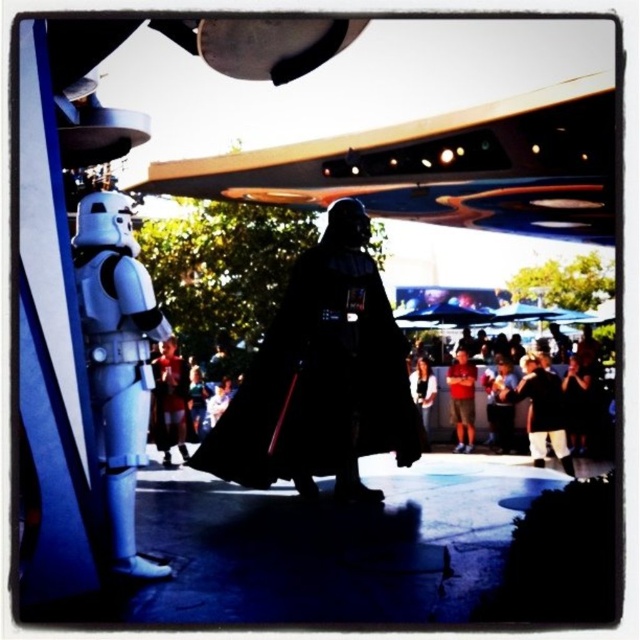
You are at an event and see the red cotton shirt at center and the white matte stormtrooper at center. Which one is positioned more to the right?

The red cotton shirt at center is positioned more to the right than the white matte stormtrooper at center.

You are a photographer setting up a shot in this scene. You need to ensure that the red cotton shirt at center and the white matte stormtrooper at center are both visible in the frame. Which object should you adjust your camera angle to prioritize if you want to capture the wider object?

The red cotton shirt at center is wider than the white matte stormtrooper at center. To prioritize capturing the wider object, adjust your camera angle to focus on the red cotton shirt at center.

Looking at this image, you are a photographer trying to capture both the orange shorts at center and the red cotton shirt at center in a single frame. Which object should you focus on first if you want to ensure both are in focus, considering their sizes?

The orange shorts at center is smaller than the red cotton shirt at center, so you should focus on the orange shorts at center first because smaller objects require precise focusing to capture details clearly while larger objects like the red cotton shirt at center can tolerate slight focus adjustments.